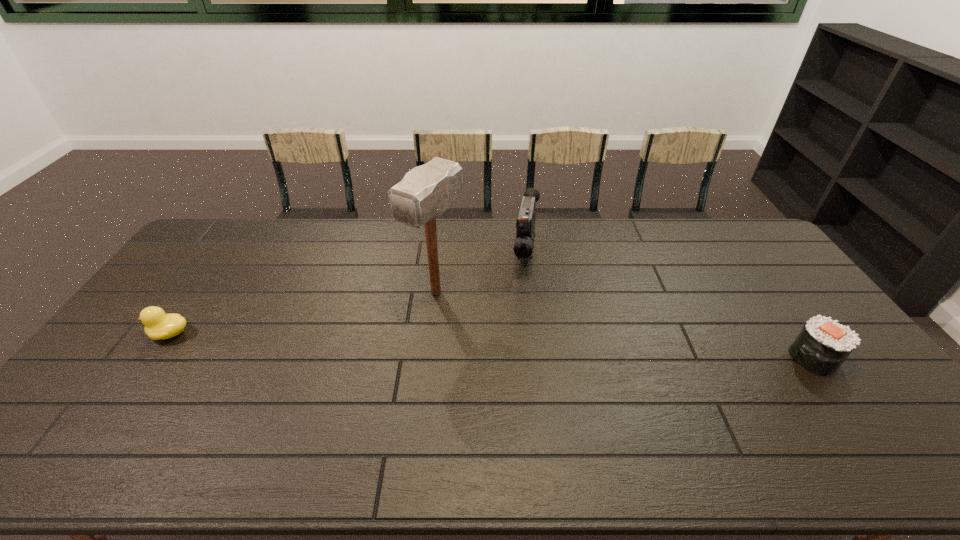
Locate an element on the screen. The width and height of the screenshot is (960, 540). free space on the desktop that is between the leftmost object and the rightmost object and is positioned on the front-facing side of the third object from left to right is located at coordinates (516, 346).

At what (x,y) coordinates should I click in order to perform the action: click on vacant spot on the desktop that is between the leftmost object and the rightmost object and is positioned on the striking face of the mallet. Please return your answer as a coordinate pair (x, y). This screenshot has height=540, width=960. Looking at the image, I should click on (389, 342).